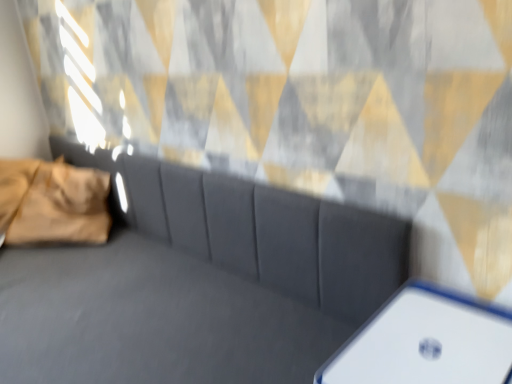
Question: Does white plastic phone at lower right have a lesser height compared to suede gray couch at center?

Choices:
 (A) yes
 (B) no

Answer: (A)

Question: Is white plastic phone at lower right outside of suede gray couch at center?

Choices:
 (A) no
 (B) yes

Answer: (B)

Question: Would you say white plastic phone at lower right is a long distance from suede gray couch at center?

Choices:
 (A) yes
 (B) no

Answer: (B)

Question: Could you tell me if white plastic phone at lower right is facing suede gray couch at center?

Choices:
 (A) no
 (B) yes

Answer: (B)

Question: Is white plastic phone at lower right at the right side of suede gray couch at center?

Choices:
 (A) no
 (B) yes

Answer: (B)

Question: In terms of width, does suede gray couch at center look wider or thinner when compared to white plastic phone at lower right?

Choices:
 (A) thin
 (B) wide

Answer: (B)

Question: Is suede gray couch at center taller or shorter than white plastic phone at lower right?

Choices:
 (A) short
 (B) tall

Answer: (B)

Question: From the image's perspective, is suede gray couch at center above or below white plastic phone at lower right?

Choices:
 (A) below
 (B) above

Answer: (B)

Question: Relative to white plastic phone at lower right, is suede gray couch at center in front or behind?

Choices:
 (A) behind
 (B) front

Answer: (B)

Question: Considering the positions of suede gray couch at center and golden velvet pillow at left in the image, is suede gray couch at center bigger or smaller than golden velvet pillow at left?

Choices:
 (A) big
 (B) small

Answer: (A)

Question: Relative to golden velvet pillow at left, is suede gray couch at center in front or behind?

Choices:
 (A) behind
 (B) front

Answer: (B)

Question: Considering the positions of suede gray couch at center and golden velvet pillow at left in the image, is suede gray couch at center taller or shorter than golden velvet pillow at left?

Choices:
 (A) short
 (B) tall

Answer: (B)

Question: Considering the positions of point (35, 294) and point (96, 228), is point (35, 294) closer or farther from the camera than point (96, 228)?

Choices:
 (A) farther
 (B) closer

Answer: (B)

Question: From the image's perspective, is white plastic phone at lower right above or below suede gray couch at center?

Choices:
 (A) below
 (B) above

Answer: (A)

Question: Is point (357, 365) positioned closer to the camera than point (221, 193)?

Choices:
 (A) farther
 (B) closer

Answer: (B)